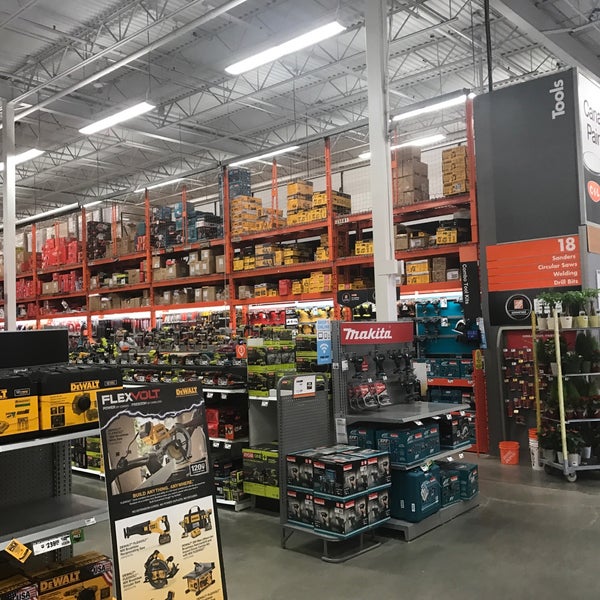
Find the location of `support beam`. support beam is located at coordinates pos(9,258), pos(382,202).